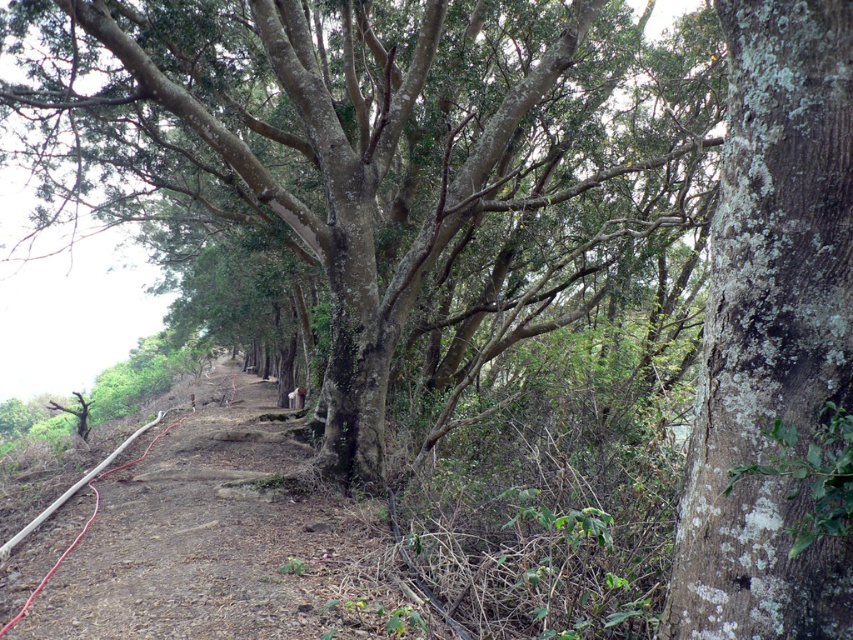
Question: Does lichen-covered tree trunk at center appear under lichen-covered bark tree at right?

Choices:
 (A) no
 (B) yes

Answer: (A)

Question: Among these objects, which one is farthest from the camera?

Choices:
 (A) lichen-covered bark tree at right
 (B) lichen-covered tree trunk at center

Answer: (B)

Question: Can you confirm if lichen-covered tree trunk at center is smaller than lichen-covered bark tree at right?

Choices:
 (A) yes
 (B) no

Answer: (B)

Question: Can you confirm if lichen-covered tree trunk at center is positioned above lichen-covered bark tree at right?

Choices:
 (A) yes
 (B) no

Answer: (A)